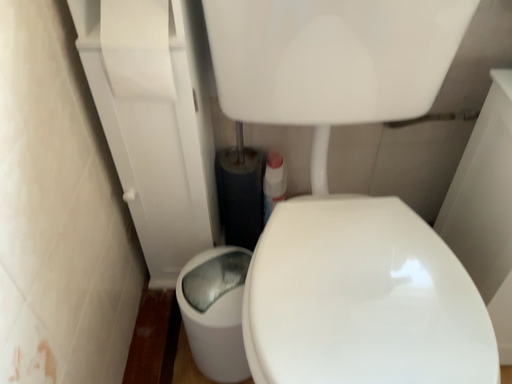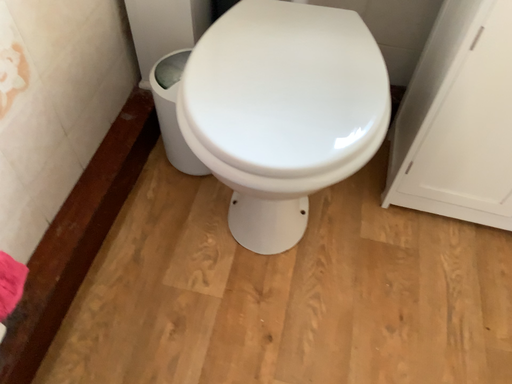
Question: Which way did the camera rotate in the video?

Choices:
 (A) rotated upward
 (B) rotated downward

Answer: (B)